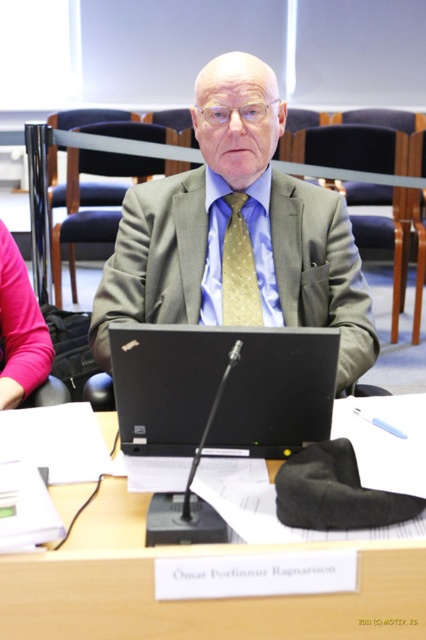
Measure the distance from wooden table at center to black matte laptop at center.

wooden table at center is 24.27 centimeters away from black matte laptop at center.

Between wooden table at center and black matte laptop at center, which one appears on the right side from the viewer's perspective?

black matte laptop at center is more to the right.

Measure the distance between point (115, 484) and camera.

They are 1.02 meters apart.

Where is `wooden table at center`? wooden table at center is located at coordinates (195, 600).

Is wooden table at center bigger than gold dotted fabric tie at center?

Correct, wooden table at center is larger in size than gold dotted fabric tie at center.

Does wooden table at center appear on the left side of gold dotted fabric tie at center?

Correct, you'll find wooden table at center to the left of gold dotted fabric tie at center.

What are the coordinates of `wooden table at center` in the screenshot? It's located at (195, 600).

The image size is (426, 640). I want to click on wooden table at center, so click(x=195, y=600).

Who is more forward, (x=405, y=630) or (x=141, y=248)?

Positioned in front is point (x=405, y=630).

Is point (250, 620) positioned after point (164, 285)?

No, it is in front of (164, 285).

Measure the distance between point (229, 554) and camera.

Point (229, 554) is 28.41 inches away from camera.

Find the location of `wooden table at center`. wooden table at center is located at coordinates (195, 600).